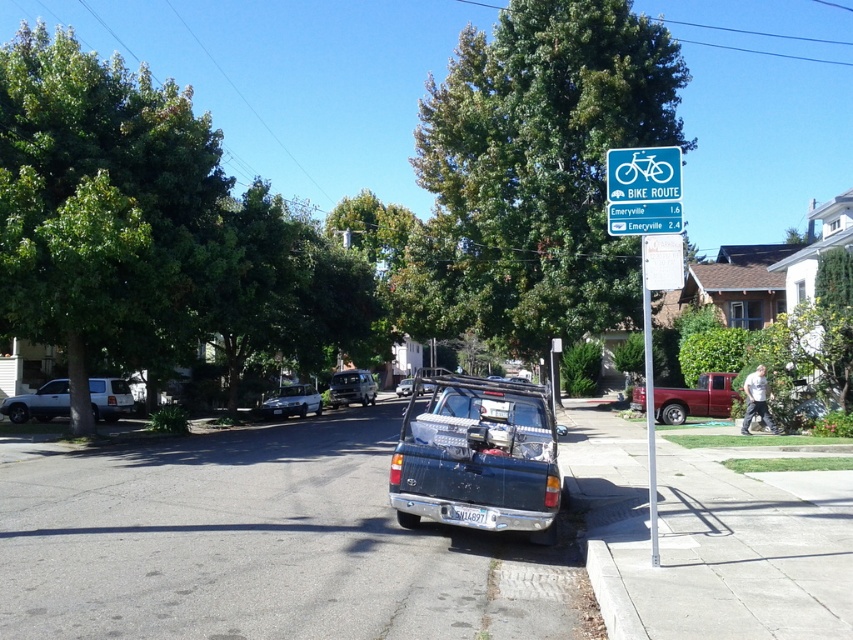
You are standing at the position of the dark pickup truck parked on the right side of the road. You want to walk towards the point that is closer to you. Which point should you head towards, point (482, 259) or point (282, 396)?

You should head towards point (482, 259) because it is closer to the camera than point (282, 396).

You are a delivery person trying to park your vehicle in this suburban street scene. The matte black truck at center is currently occupying a spot. Based on its coordinates, can you estimate whether there is enough space to park your car parallel to it?

The matte black truck at center is positioned at coordinates point (x=479, y=456). Without additional information about parking space dimensions or available area, it is impossible to determine if there is sufficient space to park parallel to it.

You are a delivery person who needs to place a 12 inch long package between the blue plastic sign at upper right and the metallic silver pole at right. Can the package fit in the space between them?

The blue plastic sign at upper right and metallic silver pole at right are 14.56 inches apart, so yes, the 12 inch long package can fit between them as there is enough space.